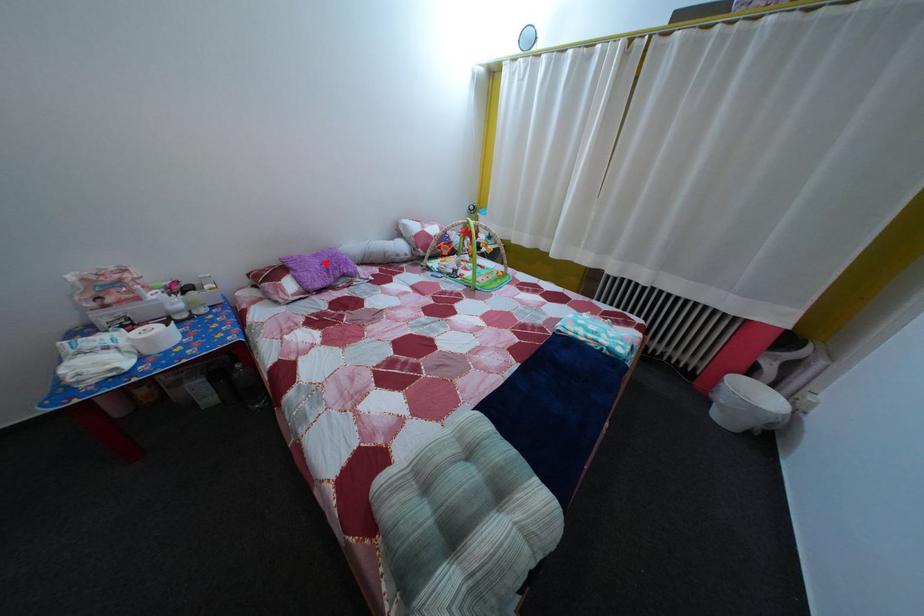
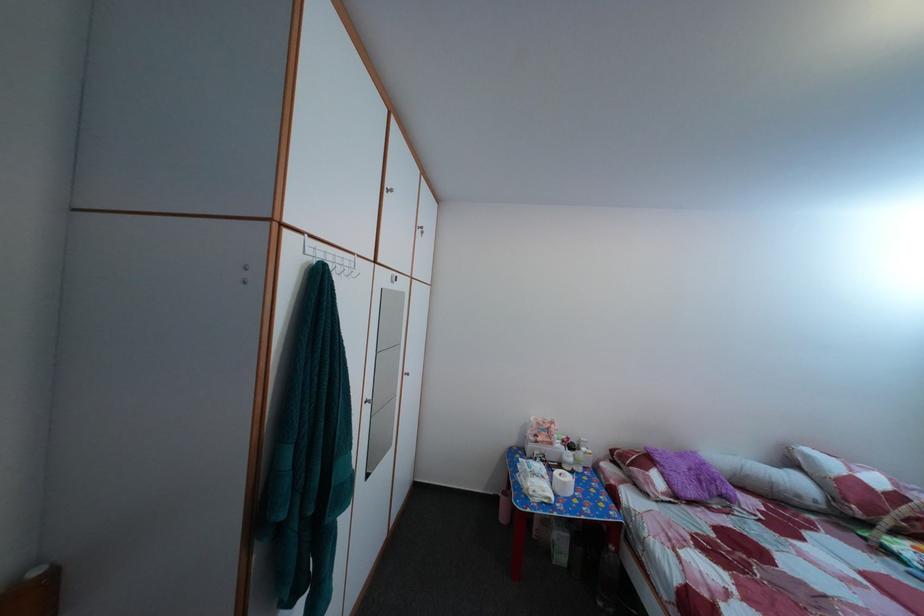
Question: I am providing you with two images of the same scene from different viewpoints. Given a red point in image1, look at the same physical point in image2. Is it:

Choices:
 (A) Closer to the viewpoint
 (B) Farther from the viewpoint

Answer: (B)